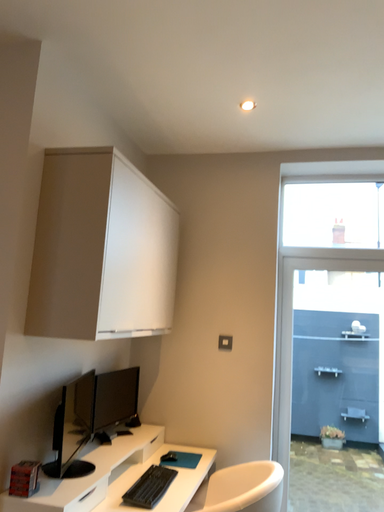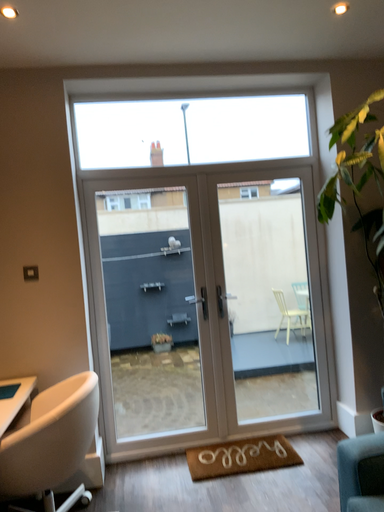
Question: How did the camera likely rotate when shooting the video?

Choices:
 (A) rotated upward
 (B) rotated downward

Answer: (B)